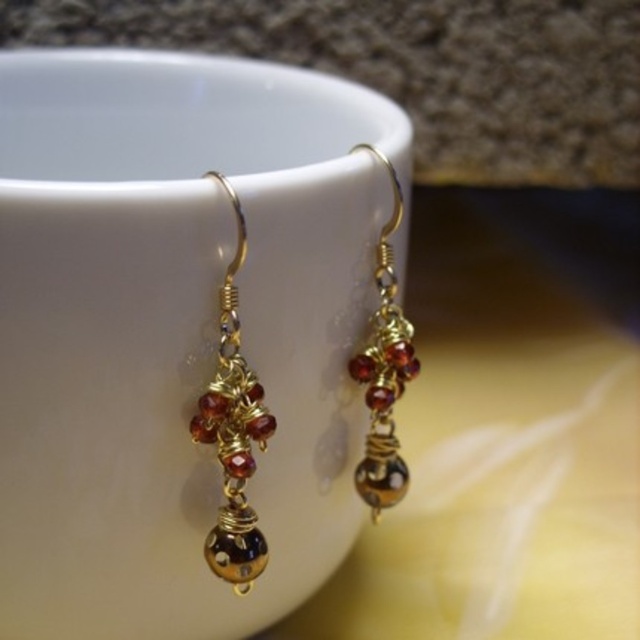
Is white ceramic mug at upper center positioned at the back of gold wire wrapped earrings at center?

No, it is not.

Is white ceramic mug at upper center taller than gold wire wrapped earrings at center?

Yes, white ceramic mug at upper center is taller than gold wire wrapped earrings at center.

Which is behind, point (38, 484) or point (371, 387)?

Point (371, 387)

Identify the location of white ceramic mug at upper center. The height and width of the screenshot is (640, 640). (192, 337).

Does gold wire wrapped earrings at left appear on the right side of gold wire wrapped earrings at center?

In fact, gold wire wrapped earrings at left is to the left of gold wire wrapped earrings at center.

Where is `gold wire wrapped earrings at left`? gold wire wrapped earrings at left is located at coordinates (234, 433).

Image resolution: width=640 pixels, height=640 pixels. Describe the element at coordinates (234, 433) in the screenshot. I see `gold wire wrapped earrings at left` at that location.

Where is `gold wire wrapped earrings at left`? This screenshot has height=640, width=640. gold wire wrapped earrings at left is located at coordinates (234, 433).

Does white ceramic mug at upper center have a smaller size compared to gold wire wrapped earrings at left?

No, white ceramic mug at upper center is not smaller than gold wire wrapped earrings at left.

Can you confirm if white ceramic mug at upper center is taller than gold wire wrapped earrings at left?

Yes, white ceramic mug at upper center is taller than gold wire wrapped earrings at left.

Who is more forward, (244,150) or (234,397)?

Point (234,397) is more forward.

Find the location of a particular element. white ceramic mug at upper center is located at coordinates (192, 337).